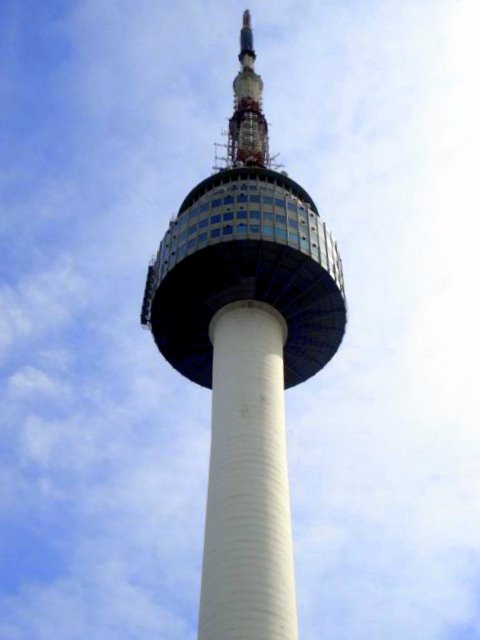
Where is `empty space to the right of the cylindrical pillar`? empty space to the right of the cylindrical pillar is located at coordinates (296, 546).